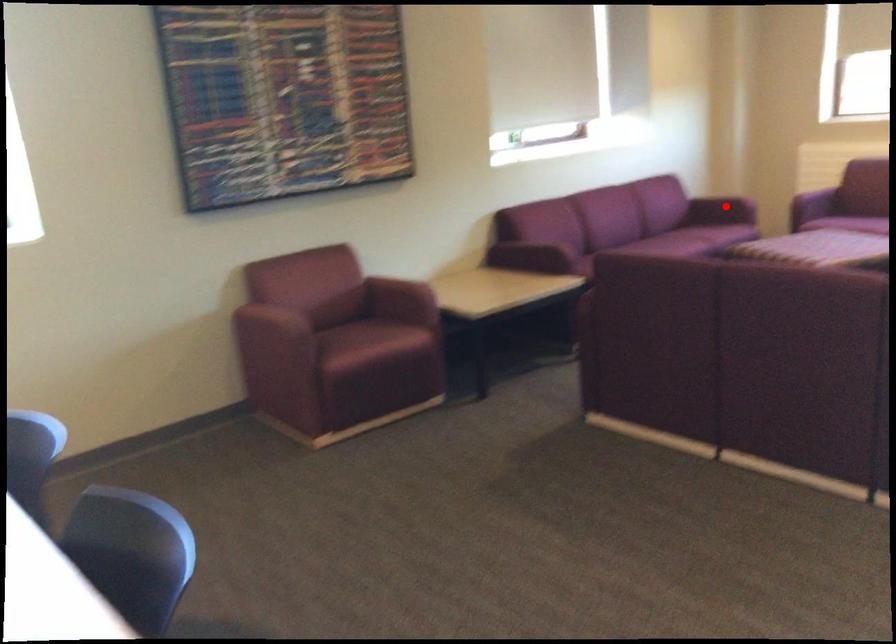
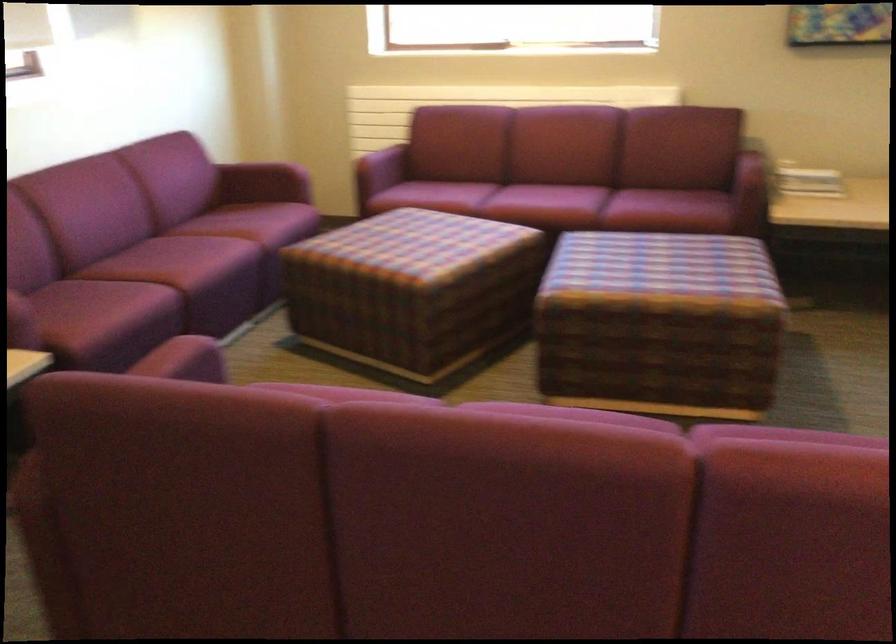
Question: I am providing you with two images of the same scene from different viewpoints. A red point is shown in image1. For the corresponding object point in image2, is it positioned nearer or farther from the camera?

Choices:
 (A) Nearer
 (B) Farther

Answer: (A)